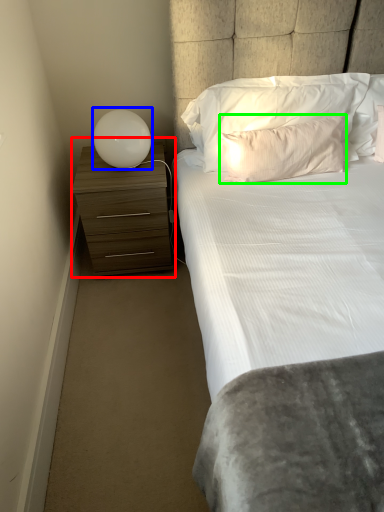
Question: Which is farther away from chest of drawers (highlighted by a red box)? lamp (highlighted by a blue box) or pillow (highlighted by a green box)?

Choices:
 (A) lamp
 (B) pillow

Answer: (B)